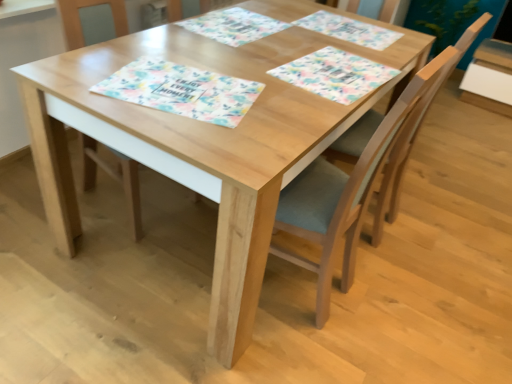
Question: Is wooden chair at center, which is the third chair in right-to-left order, touching wooden chair at center, which is the second chair from left to right?

Choices:
 (A) no
 (B) yes

Answer: (A)

Question: Is the depth of wooden chair at center, the first chair from the left, less than that of wooden chair at center, placed as the second chair when sorted from right to left?

Choices:
 (A) yes
 (B) no

Answer: (B)

Question: Can you confirm if wooden chair at center, the first chair from the left, is thinner than wooden chair at center, placed as the second chair when sorted from right to left?

Choices:
 (A) yes
 (B) no

Answer: (B)

Question: Considering the relative positions of wooden chair at center, which is the third chair in right-to-left order, and wooden chair at center, which is the second chair from left to right, in the image provided, is wooden chair at center, which is the third chair in right-to-left order, behind wooden chair at center, which is the second chair from left to right,?

Choices:
 (A) no
 (B) yes

Answer: (B)

Question: Does wooden chair at center, the first chair from the left, have a greater height compared to wooden chair at center, placed as the second chair when sorted from right to left?

Choices:
 (A) yes
 (B) no

Answer: (B)

Question: From the image's perspective, is light brown wood chair at center, the first chair in the right-to-left sequence, above or below wooden chair at center, placed as the second chair when sorted from right to left?

Choices:
 (A) above
 (B) below

Answer: (A)

Question: In terms of height, does light brown wood chair at center, the third chair positioned from the left, look taller or shorter compared to wooden chair at center, which is the second chair from left to right?

Choices:
 (A) short
 (B) tall

Answer: (A)

Question: Based on their sizes in the image, would you say light brown wood chair at center, the third chair positioned from the left, is bigger or smaller than wooden chair at center, which is the second chair from left to right?

Choices:
 (A) big
 (B) small

Answer: (B)

Question: Is light brown wood chair at center, the third chair positioned from the left, to the left or to the right of wooden chair at center, which is the second chair from left to right, in the image?

Choices:
 (A) left
 (B) right

Answer: (B)

Question: From a real-world perspective, is floral paper placemat at upper center, the third place mat in the front-to-back sequence, positioned above or below floral paper placemat at center, which is the 3th place mat from back to front?

Choices:
 (A) above
 (B) below

Answer: (A)

Question: In terms of width, does floral paper placemat at upper center, the 2th place mat viewed from the back, look wider or thinner when compared to floral paper placemat at center, acting as the 2th place mat starting from the front?

Choices:
 (A) wide
 (B) thin

Answer: (B)

Question: Considering the positions of floral paper placemat at upper center, the 2th place mat viewed from the back, and floral paper placemat at center, acting as the 2th place mat starting from the front, in the image, is floral paper placemat at upper center, the 2th place mat viewed from the back, taller or shorter than floral paper placemat at center, acting as the 2th place mat starting from the front,?

Choices:
 (A) short
 (B) tall

Answer: (A)

Question: In terms of size, does floral paper placemat at upper center, the 2th place mat viewed from the back, appear bigger or smaller than floral paper placemat at center, which is the 3th place mat from back to front?

Choices:
 (A) big
 (B) small

Answer: (B)

Question: Considering the positions of floral paper placemat at upper center, marked as the 1th place mat in a back-to-front arrangement, and light brown wood chair at center, the third chair positioned from the left, in the image, is floral paper placemat at upper center, marked as the 1th place mat in a back-to-front arrangement, bigger or smaller than light brown wood chair at center, the third chair positioned from the left,?

Choices:
 (A) small
 (B) big

Answer: (A)

Question: Is point (318, 16) positioned closer to the camera than point (410, 150)?

Choices:
 (A) closer
 (B) farther

Answer: (B)